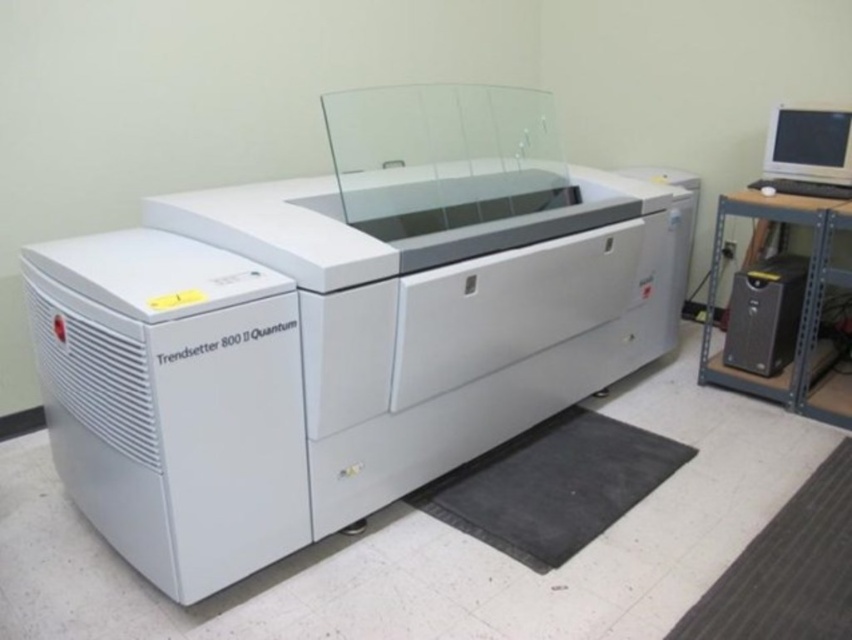
You are an engineer who needs to move a 30 inch wide box from the black plastic computer tower at right to the black rubber mat at lower right. Can you slide the box directly between them without rotating it?

The distance between the black rubber mat at lower right and the black plastic computer tower at right is 31.32 inches. Since the box is 30 inches wide, it can fit within that space without needing to rotate it.